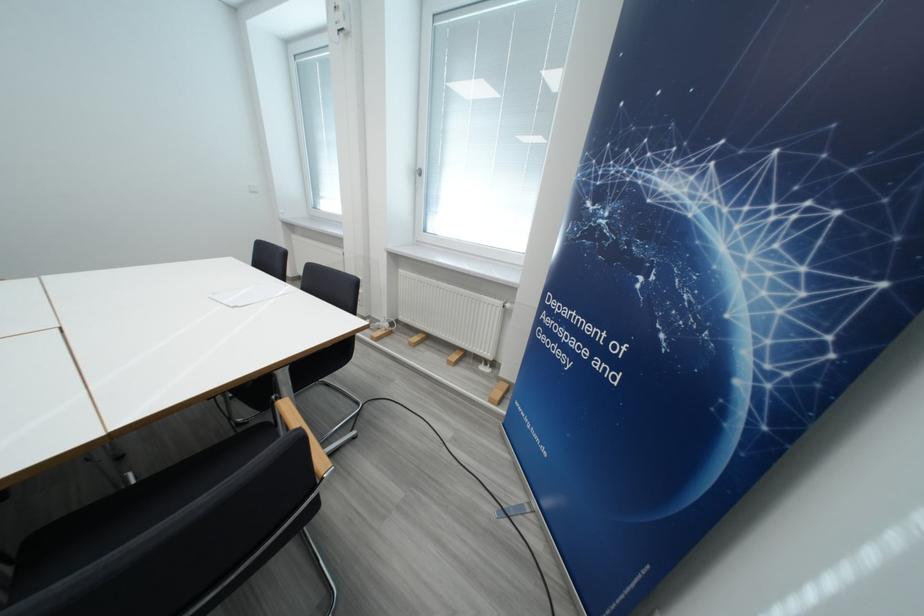
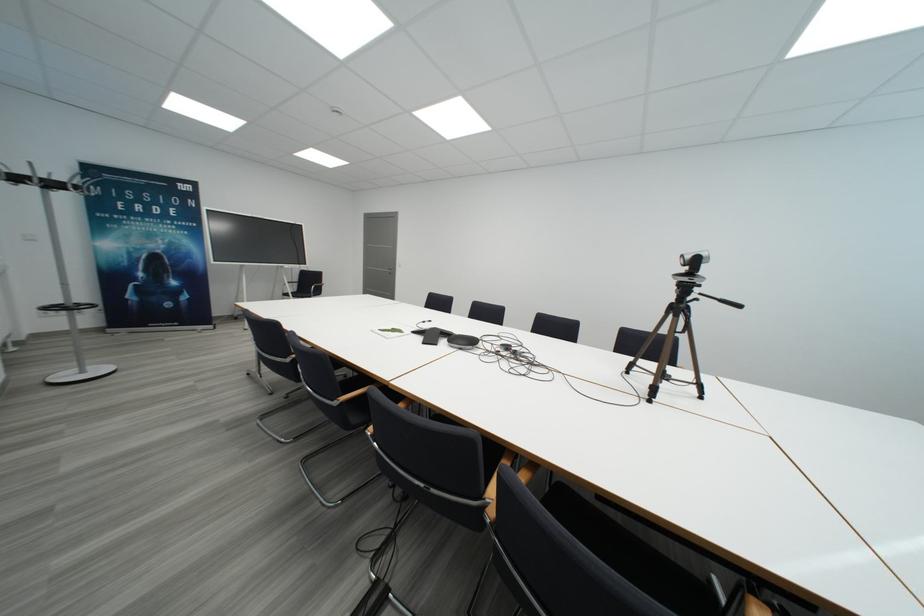
Question: How did the camera likely rotate?

Choices:
 (A) Left
 (B) Right
 (C) Up
 (D) Down

Answer: (A)